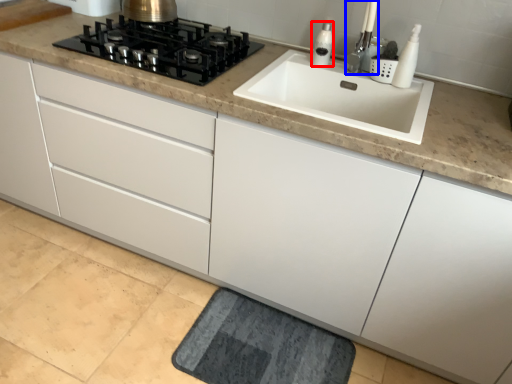
Question: Among these objects, which one is farthest to the camera, soap dispenser (highlighted by a red box) or faucet (highlighted by a blue box)?

Choices:
 (A) soap dispenser
 (B) faucet

Answer: (A)